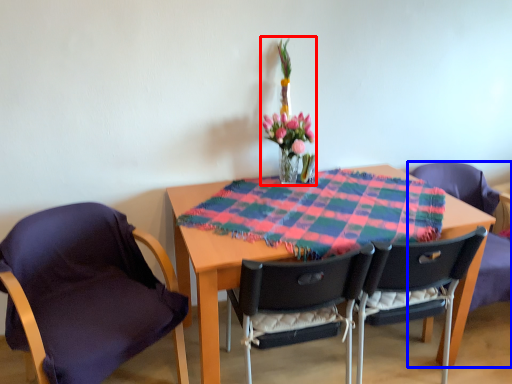
Question: Which object appears farthest to the camera in this image, floral arrangement (highlighted by a red box) or chair (highlighted by a blue box)?

Choices:
 (A) floral arrangement
 (B) chair

Answer: (B)